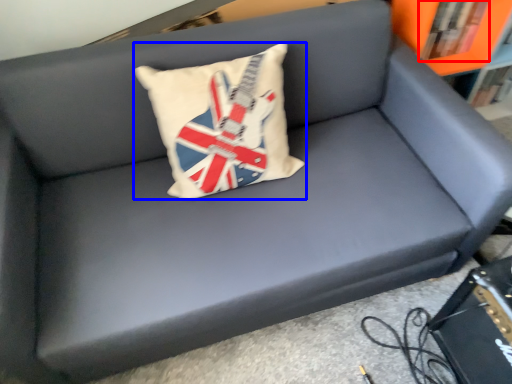
Question: Which point is further to the camera, book (highlighted by a red box) or pillow (highlighted by a blue box)?

Choices:
 (A) book
 (B) pillow

Answer: (A)